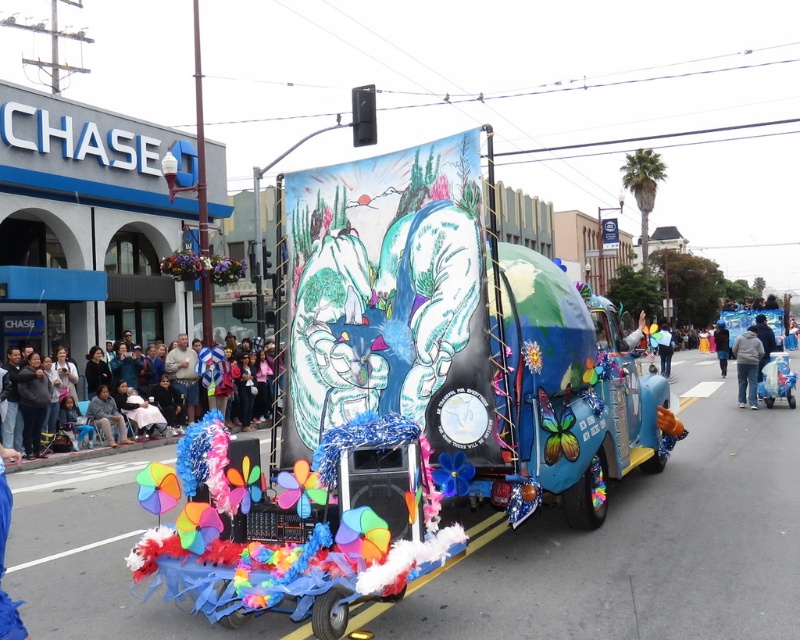
Question: Among these points, which one is farthest from the camera?

Choices:
 (A) (130, 445)
 (B) (724, 348)
 (C) (741, 364)
 (D) (670, 364)

Answer: (D)

Question: Considering the relative positions of blue fabric balloon at center and blue fabric at center in the image provided, where is blue fabric balloon at center located with respect to blue fabric at center?

Choices:
 (A) left
 (B) right

Answer: (A)

Question: Does multicolored fabric at lower left appear over blue fabric balloon at center?

Choices:
 (A) yes
 (B) no

Answer: (B)

Question: Among these objects, which one is nearest to the camera?

Choices:
 (A) blue fabric at center
 (B) blue fabric balloon at center
 (C) multicolored fabric at lower left
 (D) blue jeans at lower right

Answer: (C)

Question: Which of the following is the farthest from the observer?

Choices:
 (A) blue fabric at center
 (B) blue jeans at lower right

Answer: (A)

Question: Can you confirm if blue jeans at lower right is positioned to the left of blue fabric balloon at center?

Choices:
 (A) yes
 (B) no

Answer: (A)